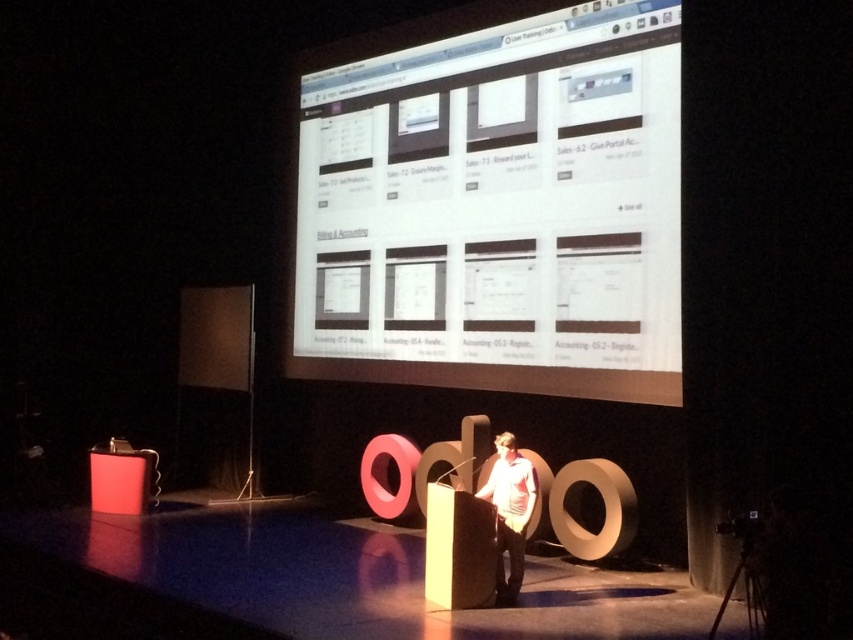
You are an attendee in the audience and want to see both the white glossy computer screen at upper center and the light pink fabric shirt at center clearly. Which one would you need to move closer to the stage to see better?

The light pink fabric shirt at center is behind the white glossy computer screen at upper center, so to see both clearly, you would need to move closer to the stage to ensure the light pink fabric shirt at center is not obscured by the screen.

You are an attendee at the presentation and want to see both the white glossy computer screen at upper center and the light pink fabric shirt at center. Which one is positioned higher in the image?

The white glossy computer screen at upper center is positioned higher than the light pink fabric shirt at center.

From the picture: You are sitting in the audience of the presentation and want to see the white glossy computer screen at upper center clearly. Considering that the screen is 17.13 feet away from you, do you think you can comfortably read the text displayed on it without moving closer?

The white glossy computer screen at upper center is 17.13 feet from the viewer, so it depends on the text size and your visual acuity. However, at this distance, it might be challenging to read small text without moving closer.